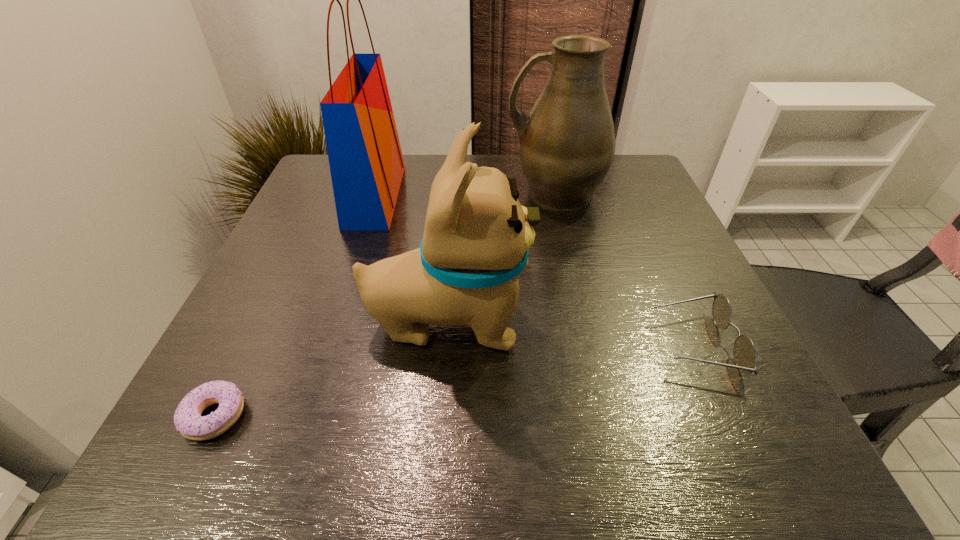
The image size is (960, 540). Identify the location of vacant space in between the shopping bag and the fourth tallest object. (536, 269).

Locate an element on the screen. Image resolution: width=960 pixels, height=540 pixels. free area in between the spectacles and the shopping bag is located at coordinates click(536, 269).

At what (x,y) coordinates should I click in order to perform the action: click on unoccupied area between the nearest object and the puppy. Please return your answer as a coordinate pair (x, y). This screenshot has width=960, height=540. Looking at the image, I should click on (331, 368).

Image resolution: width=960 pixels, height=540 pixels. Find the location of `unoccupied position between the spectacles and the pitcher`. unoccupied position between the spectacles and the pitcher is located at coordinates (625, 268).

Where is `free spot between the shortest object and the puppy`? This screenshot has width=960, height=540. free spot between the shortest object and the puppy is located at coordinates (331, 368).

I want to click on free space that is in between the puppy and the doughnut, so click(x=331, y=368).

At what (x,y) coordinates should I click in order to perform the action: click on free area in between the fourth tallest object and the nearest object. Please return your answer as a coordinate pair (x, y). Looking at the image, I should click on (455, 380).

Select which object appears as the third closest to the fourth tallest object. Please provide its 2D coordinates. Your answer should be formatted as a tuple, i.e. [(x, y)], where the tuple contains the x and y coordinates of a point satisfying the conditions above.

[(366, 163)]

Locate which object is the fourth closest to the shopping bag. Please provide its 2D coordinates. Your answer should be formatted as a tuple, i.e. [(x, y)], where the tuple contains the x and y coordinates of a point satisfying the conditions above.

[(745, 355)]

The image size is (960, 540). I want to click on free location that satisfies the following two spatial constraints: 1. on the back side of the nearest object; 2. on the handle side of the pitcher, so click(x=322, y=193).